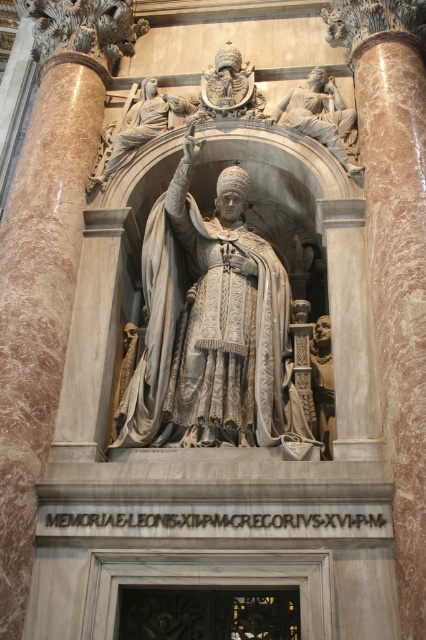
Question: Is the position of white marble statue at center more distant than that of polished bronze helmet at upper center?

Choices:
 (A) yes
 (B) no

Answer: (B)

Question: Which object appears farthest from the camera in this image?

Choices:
 (A) polished stone statue at center
 (B) white marble statue at center

Answer: (A)

Question: Which of the following is the farthest from the observer?

Choices:
 (A) (328, 320)
 (B) (331, 83)

Answer: (B)

Question: Is the position of marble statue at upper center less distant than that of polished marble statue at center?

Choices:
 (A) yes
 (B) no

Answer: (A)

Question: Can you confirm if marble column at right is smaller than marble statue at upper center?

Choices:
 (A) no
 (B) yes

Answer: (A)

Question: Which point is closer to the camera?

Choices:
 (A) (224, 244)
 (B) (218, 100)

Answer: (A)